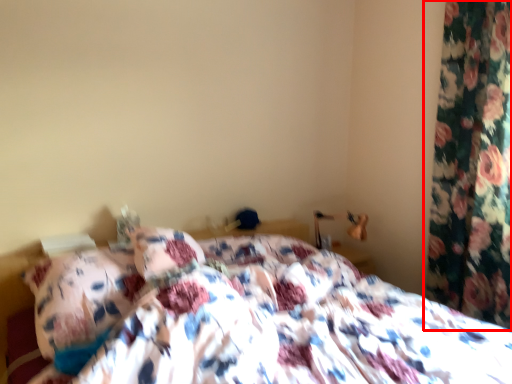
Question: From the image's perspective, what is the correct spatial positioning of curtain (annotated by the red box) in reference to bed?

Choices:
 (A) below
 (B) above

Answer: (B)